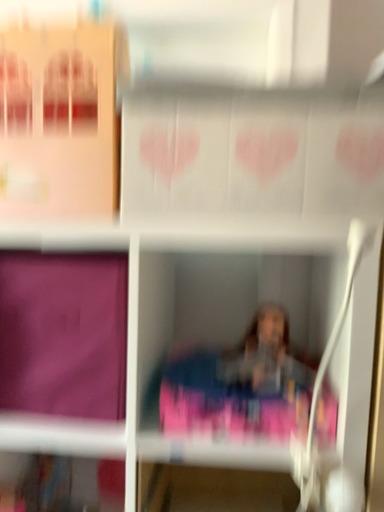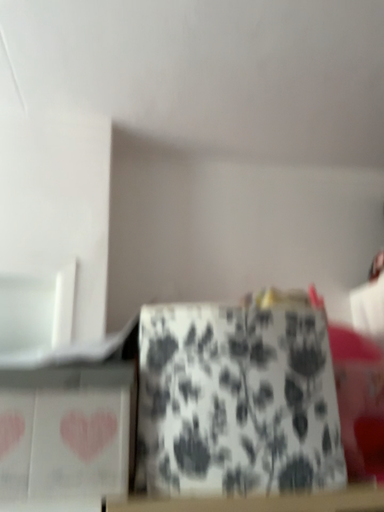
Question: How did the camera likely rotate when shooting the video?

Choices:
 (A) rotated right
 (B) rotated left

Answer: (A)